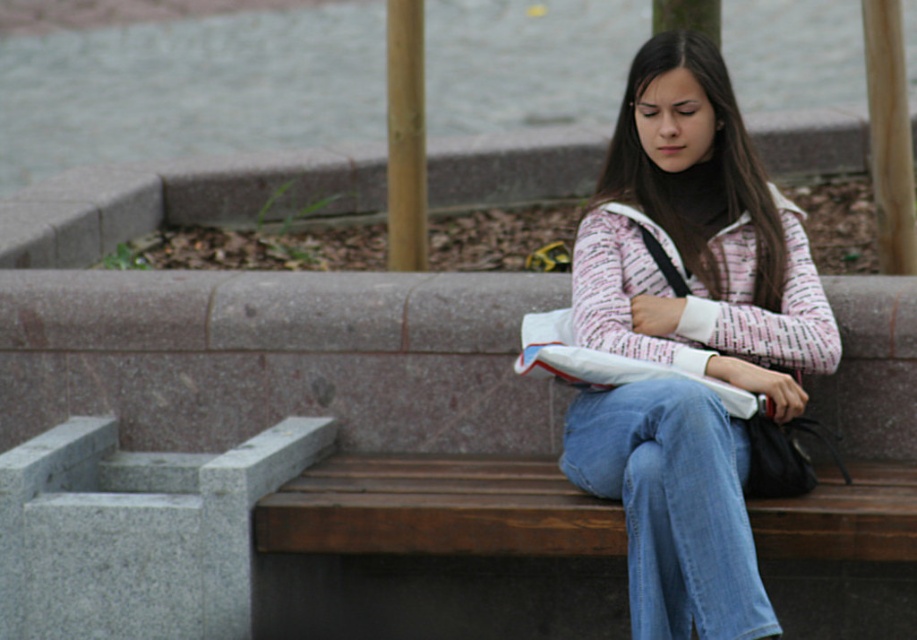
Is pink textured sweater at center thinner than denim at right?

No, pink textured sweater at center is not thinner than denim at right.

Which of these two, pink textured sweater at center or denim at right, stands shorter?

Standing shorter between the two is denim at right.

Where is `pink textured sweater at center`? The image size is (917, 640). pink textured sweater at center is located at coordinates (698, 237).

Which of these two, wooden bench at center or pink textured sweater at center, stands taller?

Standing taller between the two is pink textured sweater at center.

Is wooden bench at center to the left of pink textured sweater at center from the viewer's perspective?

Correct, you'll find wooden bench at center to the left of pink textured sweater at center.

This screenshot has width=917, height=640. Describe the element at coordinates (268, 451) in the screenshot. I see `wooden bench at center` at that location.

Find the location of a particular element. This screenshot has height=640, width=917. wooden bench at center is located at coordinates (268, 451).

Does wooden bench at center have a lesser height compared to denim at right?

Incorrect, wooden bench at center's height does not fall short of denim at right's.

Is wooden bench at center taller than denim at right?

Correct, wooden bench at center is much taller as denim at right.

Does point (499, 280) come closer to viewer compared to point (642, 381)?

No.

This screenshot has height=640, width=917. Identify the location of wooden bench at center. (268, 451).